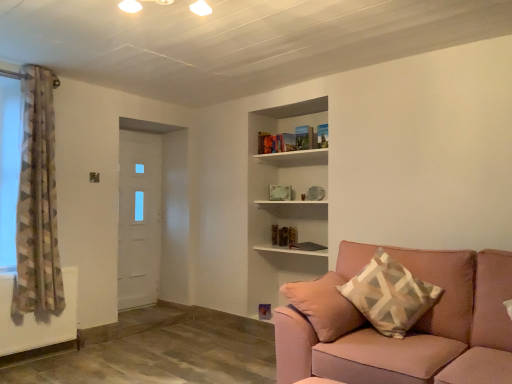
Question: Considering the relative sizes of beige geometric-patterned pillow at right and white matte door at left in the image provided, is beige geometric-patterned pillow at right smaller than white matte door at left?

Choices:
 (A) no
 (B) yes

Answer: (A)

Question: Is beige geometric-patterned pillow at right looking in the opposite direction of white matte door at left?

Choices:
 (A) yes
 (B) no

Answer: (B)

Question: From the image's perspective, is beige geometric-patterned pillow at right under white matte door at left?

Choices:
 (A) no
 (B) yes

Answer: (B)

Question: From a real-world perspective, does beige geometric-patterned pillow at right sit lower than white matte door at left?

Choices:
 (A) no
 (B) yes

Answer: (B)

Question: Does beige geometric-patterned pillow at right appear on the right side of white matte door at left?

Choices:
 (A) yes
 (B) no

Answer: (A)

Question: Is beige geometric-patterned pillow at right far away from white matte door at left?

Choices:
 (A) no
 (B) yes

Answer: (B)

Question: Is white matte door at left bigger than white wooden shelf at upper center?

Choices:
 (A) no
 (B) yes

Answer: (B)

Question: Does white matte door at left have a smaller size compared to white wooden shelf at upper center?

Choices:
 (A) no
 (B) yes

Answer: (A)

Question: Is the position of white matte door at left more distant than that of white wooden shelf at upper center?

Choices:
 (A) no
 (B) yes

Answer: (B)

Question: Considering the relative sizes of white matte door at left and white wooden shelf at upper center in the image provided, is white matte door at left wider than white wooden shelf at upper center?

Choices:
 (A) yes
 (B) no

Answer: (B)

Question: Considering the relative positions of white matte door at left and white wooden shelf at upper center in the image provided, is white matte door at left to the right of white wooden shelf at upper center from the viewer's perspective?

Choices:
 (A) no
 (B) yes

Answer: (A)

Question: From a real-world perspective, is white matte door at left under white wooden shelf at upper center?

Choices:
 (A) yes
 (B) no

Answer: (A)

Question: Can pink fabric couch at lower right be found inside white matte door at left?

Choices:
 (A) no
 (B) yes

Answer: (A)